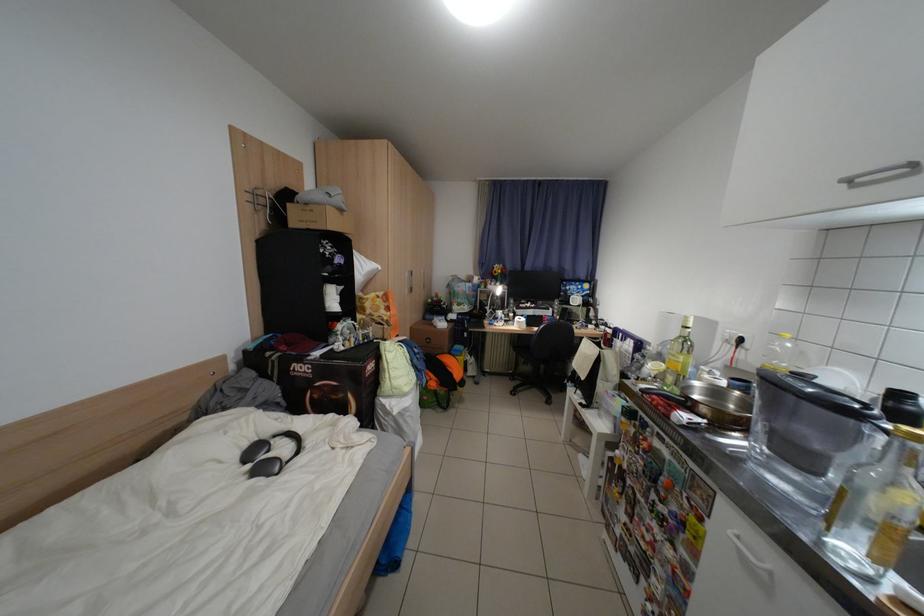
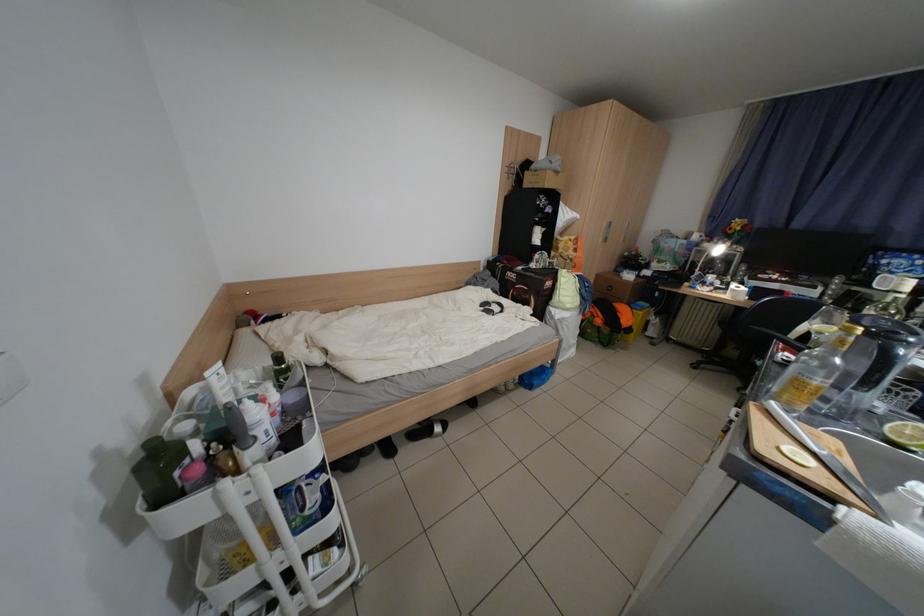
Question: The camera is either moving clockwise (left) or counter-clockwise (right) around the object. The first image is from the beginning of the video and the second image is from the end. Is the camera moving left or right when shooting the video?

Choices:
 (A) Left
 (B) Right

Answer: (B)